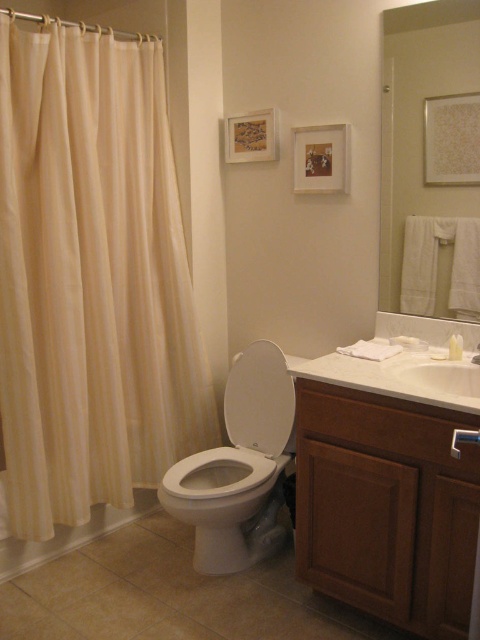
Between beige sheer curtain at left and white glossy sink at center, which one appears on the right side from the viewer's perspective?

white glossy sink at center

Find the location of `beige sheer curtain at left`. beige sheer curtain at left is located at coordinates (91, 280).

The height and width of the screenshot is (640, 480). Find the location of `beige sheer curtain at left`. beige sheer curtain at left is located at coordinates (91, 280).

Does white glossy toilet bowl at center have a greater width compared to white glossy bathtub at lower left?

Yes.

Is white glossy toilet bowl at center taller than white glossy bathtub at lower left?

Yes.

At what (x,y) coordinates should I click in order to perform the action: click on white glossy toilet bowl at center. Please return your answer as a coordinate pair (x, y). The height and width of the screenshot is (640, 480). Looking at the image, I should click on (239, 468).

Is white glossy toilet bowl at center behind white glossy sink at center?

Yes, it is.

In order to click on white glossy toilet bowl at center in this screenshot , I will do `click(239, 468)`.

Identify the location of white glossy toilet bowl at center. The image size is (480, 640). (239, 468).